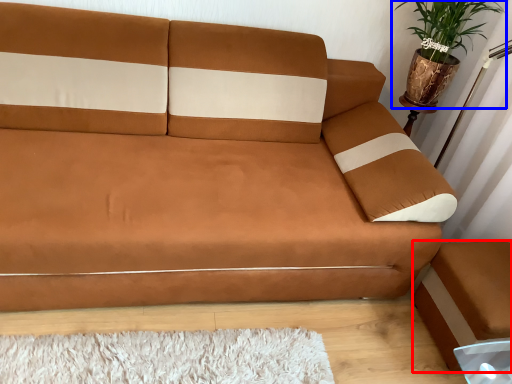
Question: Which object appears closest to the camera in this image, footrest (highlighted by a red box) or houseplant (highlighted by a blue box)?

Choices:
 (A) footrest
 (B) houseplant

Answer: (A)